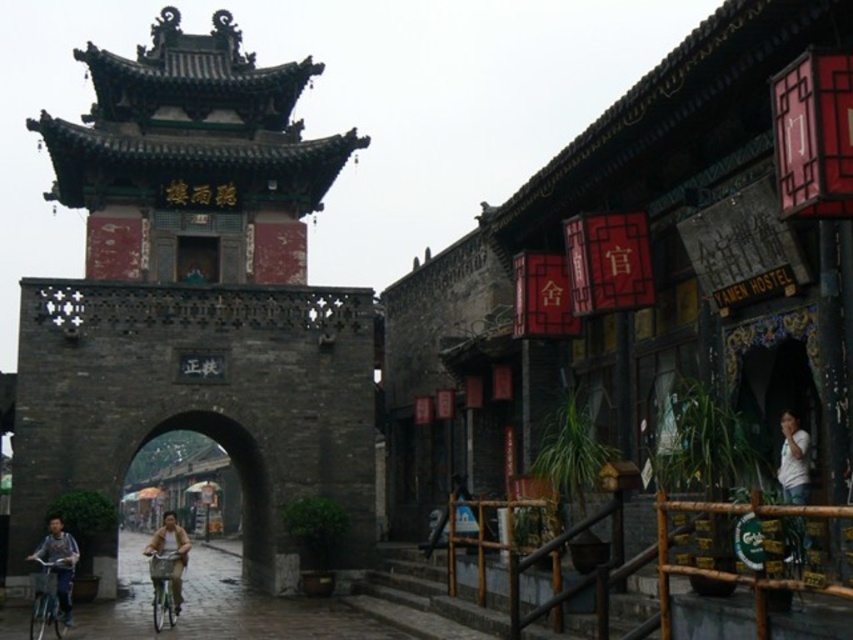
Is point (258, 554) positioned after point (166, 541)?

Yes, point (258, 554) is behind point (166, 541).

Does point (224, 426) come farther from viewer compared to point (177, 525)?

Yes, it is.

I want to click on dark gray stone archway at center, so click(238, 484).

Is dark gray stone tower at center positioned behind light brown leather jacket at center?

Yes, dark gray stone tower at center is further from the viewer.

Can you confirm if dark gray stone tower at center is positioned above light brown leather jacket at center?

Indeed, dark gray stone tower at center is positioned over light brown leather jacket at center.

Which is in front, point (103, 586) or point (177, 528)?

Point (177, 528) is in front.

This screenshot has height=640, width=853. What are the coordinates of `dark gray stone tower at center` in the screenshot? It's located at (196, 298).

Does dark gray stone tower at center appear on the left side of white cotton shirt at lower right?

Correct, you'll find dark gray stone tower at center to the left of white cotton shirt at lower right.

Does point (28, 353) come farther from viewer compared to point (808, 468)?

That is True.

Is point (276, 346) positioned in front of point (808, 470)?

No, it is not.

The height and width of the screenshot is (640, 853). I want to click on dark gray stone tower at center, so click(x=196, y=298).